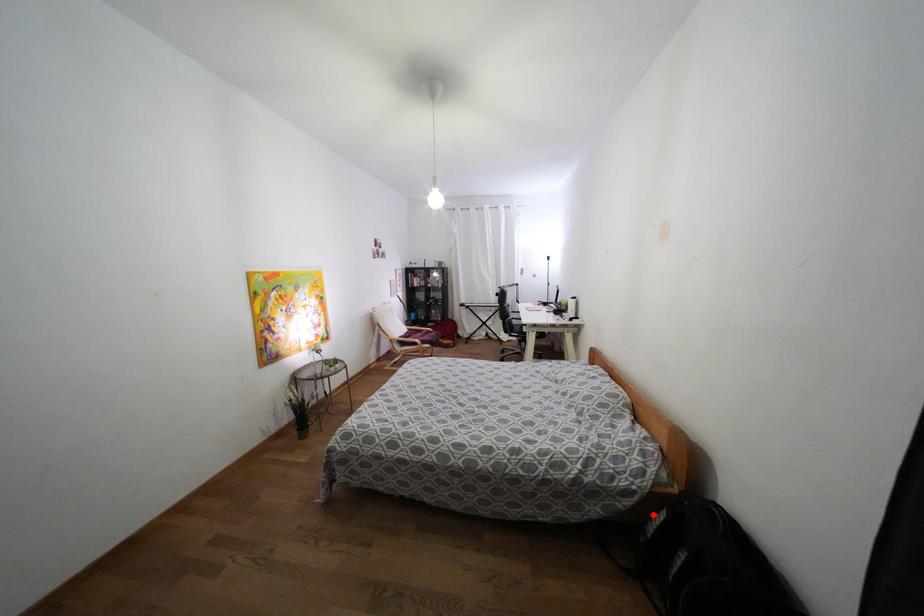
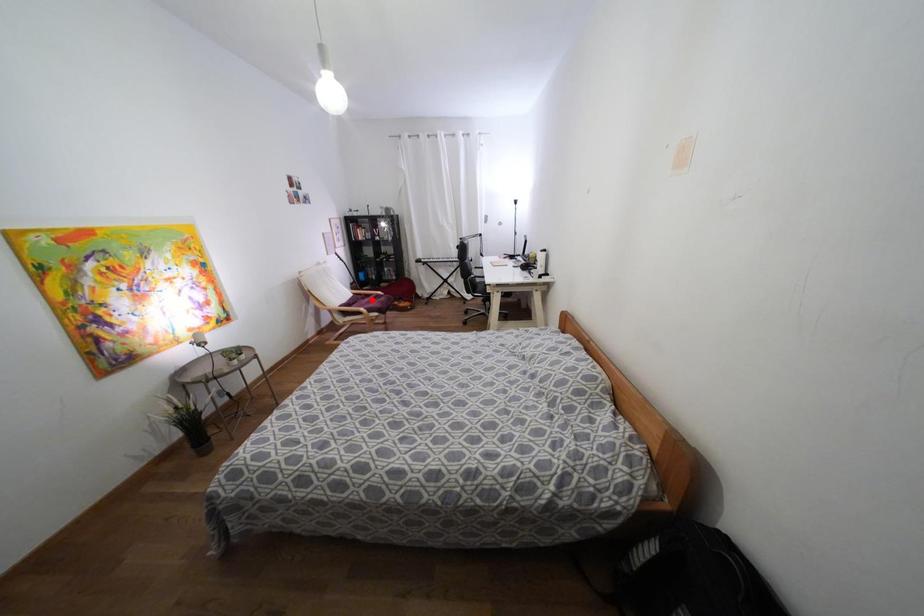
I am providing you with two images of the same scene from different viewpoints. A red point is marked on the first image and another point is marked on the second image. Does the point marked in image1 correspond to the same location as the one in image2?

No